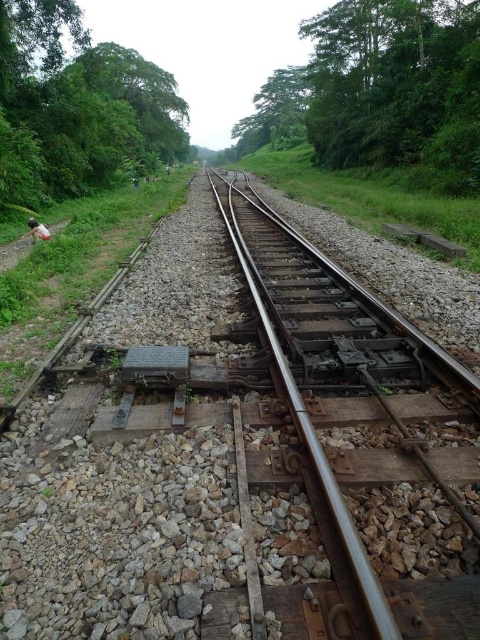
Question: Is rusty metal train track at center wider than white fabric person at left?

Choices:
 (A) no
 (B) yes

Answer: (B)

Question: Does rusty metal train track at center appear under white fabric person at left?

Choices:
 (A) yes
 (B) no

Answer: (A)

Question: Which of the following is the farthest from the observer?

Choices:
 (A) (252, 384)
 (B) (34, 228)

Answer: (B)

Question: Is rusty metal train track at center to the right of white fabric person at left from the viewer's perspective?

Choices:
 (A) yes
 (B) no

Answer: (A)